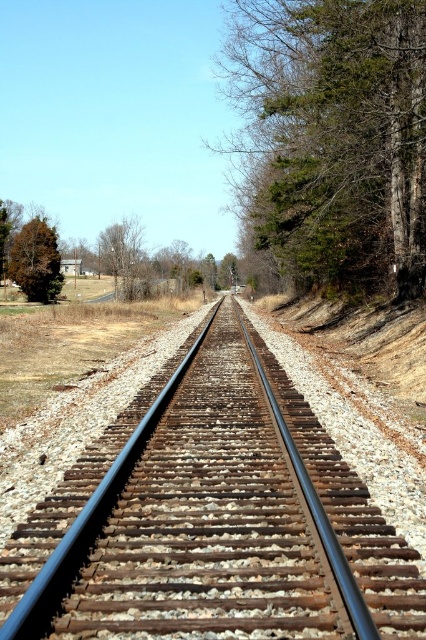
Which is more to the right, green leafy tree at right or green matte tree at left?

Positioned to the right is green leafy tree at right.

Between point (419, 0) and point (39, 260), which one is positioned behind?

The point (39, 260) is more distant.

Find the location of a particular element. green leafy tree at right is located at coordinates (333, 138).

Does rusty metal train track at center have a lesser width compared to green leafy tree at right?

Yes, rusty metal train track at center is thinner than green leafy tree at right.

Between point (218, 339) and point (238, 70), which one is positioned in front?

Point (218, 339)

The width and height of the screenshot is (426, 640). Identify the location of rusty metal train track at center. (204, 516).

Does rusty metal train track at center appear on the left side of green matte tree at left?

In fact, rusty metal train track at center is to the right of green matte tree at left.

The width and height of the screenshot is (426, 640). I want to click on rusty metal train track at center, so click(204, 516).

This screenshot has height=640, width=426. I want to click on rusty metal train track at center, so click(x=204, y=516).